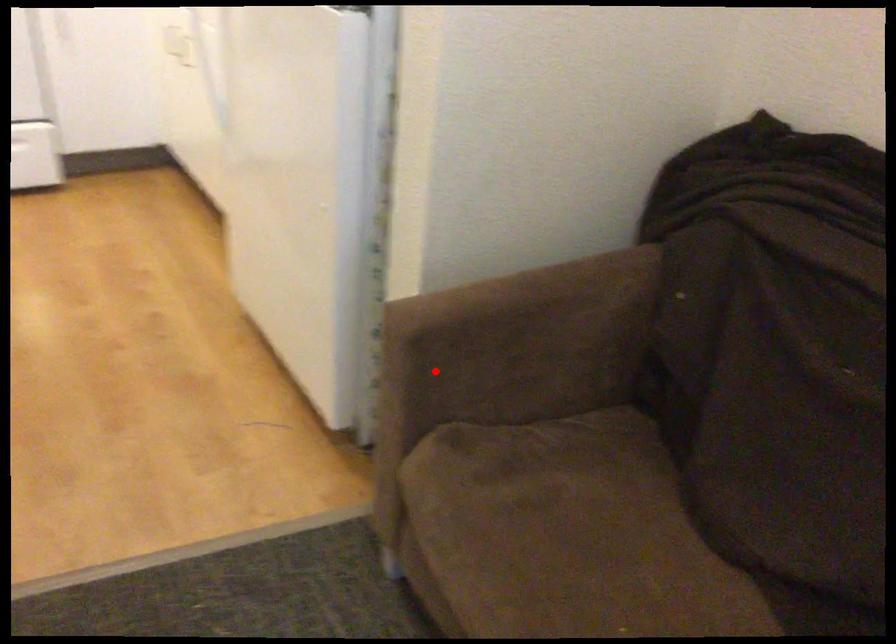
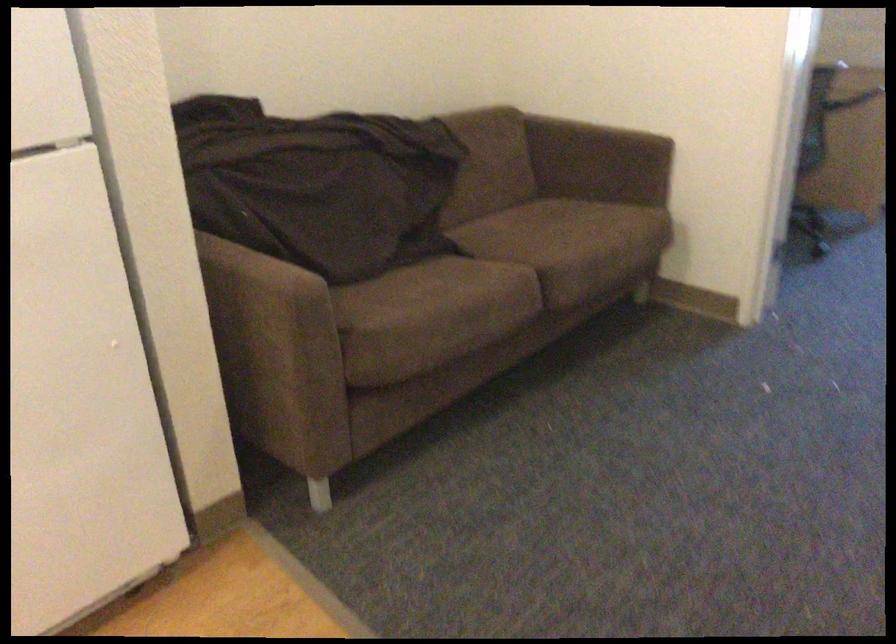
Question: I am providing you with two images of the same scene from different viewpoints. A red point is marked on the first image. At the location where the point appears in image 1, is it still visible in image 2?

Choices:
 (A) Yes
 (B) No

Answer: (A)